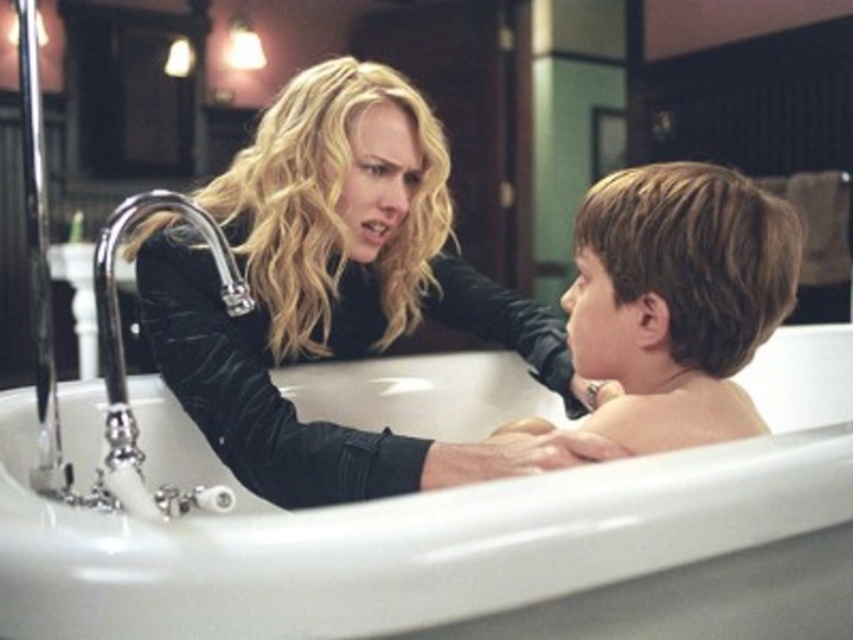
You are a home inspector checking the bathroom. You see the velvet black jacket at upper left and the polished chrome faucet at left. Which object is wider?

The velvet black jacket at upper left is wider than the polished chrome faucet at left.